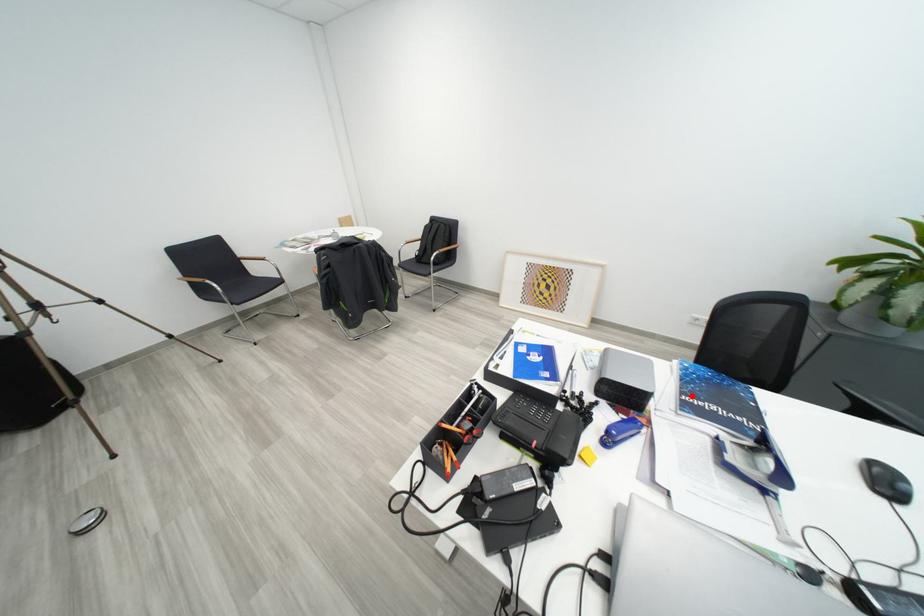
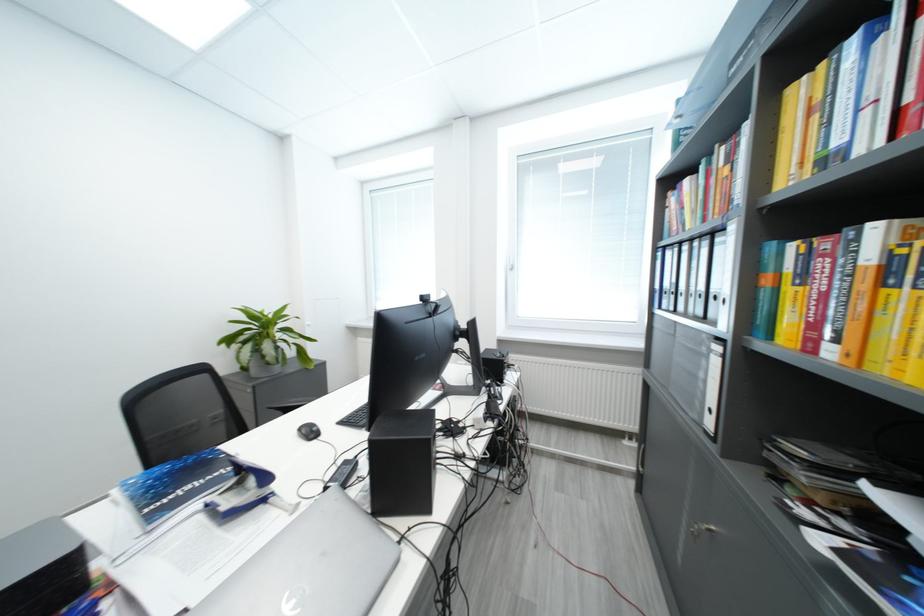
Find the pixel in the second image that matches the highlighted location in the first image.

(152, 511)